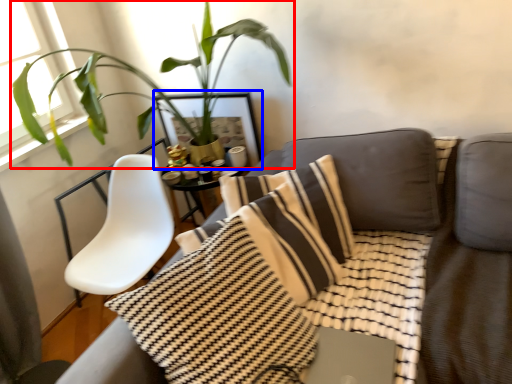
Question: Which object is closer to the camera taking this photo, houseplant (highlighted by a red box) or picture frame (highlighted by a blue box)?

Choices:
 (A) houseplant
 (B) picture frame

Answer: (A)